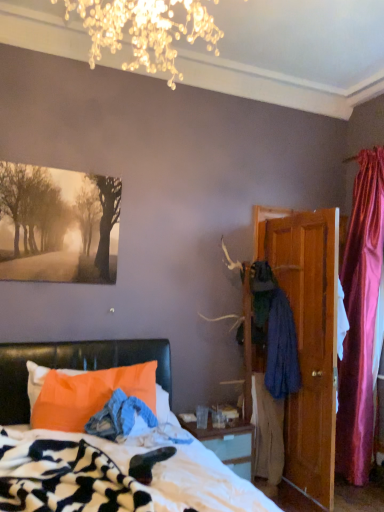
Question: Is dark blue fabric coat at right completely or partially outside of wooden door at right?

Choices:
 (A) no
 (B) yes

Answer: (B)

Question: Considering the relative sizes of dark blue fabric coat at right and wooden door at right in the image provided, is dark blue fabric coat at right smaller than wooden door at right?

Choices:
 (A) no
 (B) yes

Answer: (B)

Question: From the image's perspective, is dark blue fabric coat at right on wooden door at right?

Choices:
 (A) no
 (B) yes

Answer: (A)

Question: Is dark blue fabric coat at right positioned with its back to wooden door at right?

Choices:
 (A) yes
 (B) no

Answer: (B)

Question: Is dark blue fabric coat at right positioned far away from wooden door at right?

Choices:
 (A) no
 (B) yes

Answer: (A)

Question: From a real-world perspective, is matte black painting at upper left physically located above or below wooden door at right?

Choices:
 (A) above
 (B) below

Answer: (A)

Question: Considering the positions of point (91, 266) and point (321, 261), is point (91, 266) closer or farther from the camera than point (321, 261)?

Choices:
 (A) closer
 (B) farther

Answer: (A)

Question: From the image's perspective, is matte black painting at upper left above or below wooden door at right?

Choices:
 (A) below
 (B) above

Answer: (B)

Question: Is matte black painting at upper left in front of or behind wooden door at right in the image?

Choices:
 (A) behind
 (B) front

Answer: (B)

Question: Based on their positions, is matte black painting at upper left located to the left or right of orange fabric pillow at lower left?

Choices:
 (A) left
 (B) right

Answer: (A)

Question: From a real-world perspective, is matte black painting at upper left physically located above or below orange fabric pillow at lower left?

Choices:
 (A) below
 (B) above

Answer: (B)

Question: In terms of width, does matte black painting at upper left look wider or thinner when compared to orange fabric pillow at lower left?

Choices:
 (A) wide
 (B) thin

Answer: (B)

Question: From the image's perspective, relative to orange fabric pillow at lower left, is matte black painting at upper left above or below?

Choices:
 (A) above
 (B) below

Answer: (A)

Question: Considering the positions of orange fabric pillow at lower left and wooden door at right in the image, is orange fabric pillow at lower left wider or thinner than wooden door at right?

Choices:
 (A) thin
 (B) wide

Answer: (A)

Question: From the image's perspective, is orange fabric pillow at lower left positioned above or below wooden door at right?

Choices:
 (A) above
 (B) below

Answer: (B)